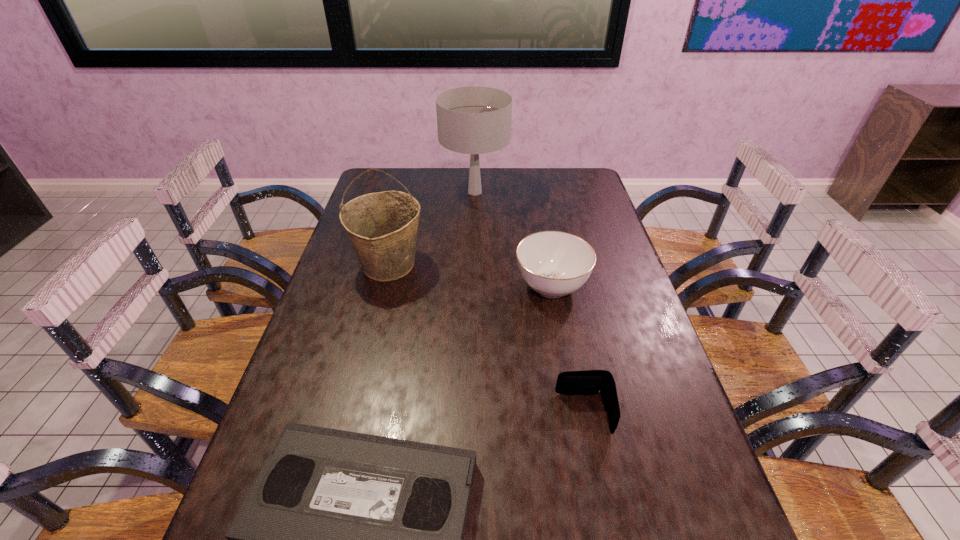
Identify the location of empty location between the third shortest object and the wallet. This screenshot has width=960, height=540. (567, 350).

This screenshot has height=540, width=960. What are the coordinates of `free space between the chinaware and the second shortest object` in the screenshot? It's located at (567, 350).

Locate an element on the screen. free space between the wallet and the wine bucket is located at coordinates (487, 339).

Locate an element on the screen. This screenshot has width=960, height=540. empty space between the wallet and the farthest object is located at coordinates (530, 302).

You are a GUI agent. You are given a task and a screenshot of the screen. Output one action in this format:
    pyautogui.click(x=<x>, y=<y>)
    Task: Click on the free spot between the fourth tallest object and the third tallest object
    
    Given the screenshot: What is the action you would take?
    pyautogui.click(x=567, y=350)

Where is `vacant area that lies between the wine bucket and the lampshade`? Image resolution: width=960 pixels, height=540 pixels. vacant area that lies between the wine bucket and the lampshade is located at coordinates (432, 228).

Find the location of a particular element. This screenshot has height=540, width=960. the fourth closest object relative to the chinaware is located at coordinates (345, 539).

In order to click on object that is the second closest one to the third tallest object in this screenshot , I will do `click(382, 227)`.

Where is `vacant position in the image that satisfies the following two spatial constraints: 1. on the front-facing side of the lampshade; 2. on the left side of the third tallest object`? Image resolution: width=960 pixels, height=540 pixels. vacant position in the image that satisfies the following two spatial constraints: 1. on the front-facing side of the lampshade; 2. on the left side of the third tallest object is located at coordinates (473, 286).

Locate an element on the screen. free region that satisfies the following two spatial constraints: 1. on the front-facing side of the chinaware; 2. on the right side of the farthest object is located at coordinates (473, 286).